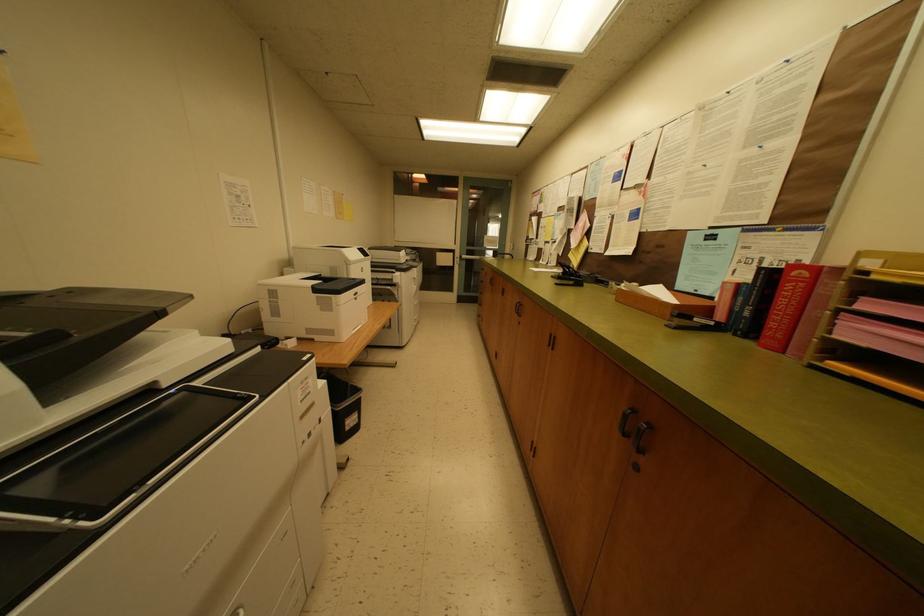
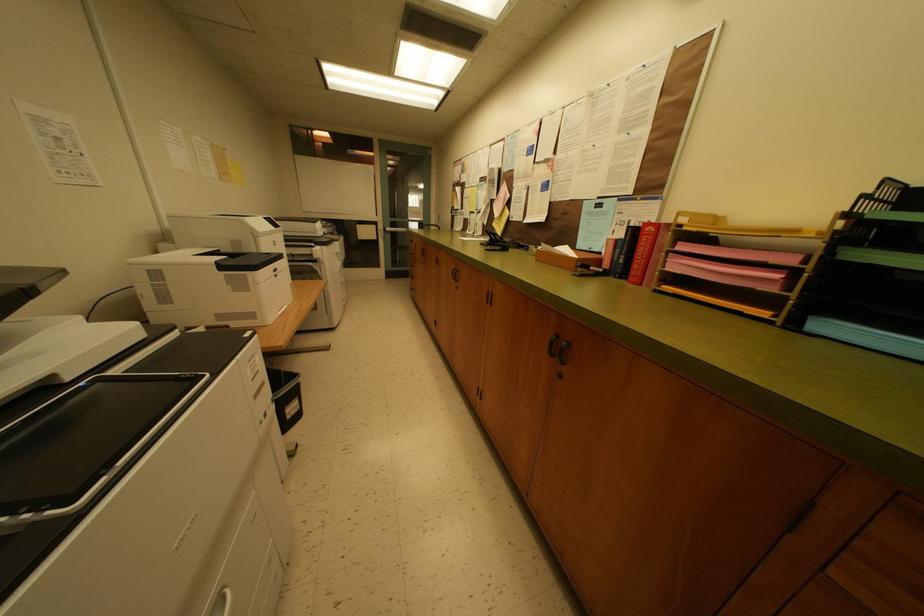
Question: Based on the continuous images, in which direction is the camera rotating? Reply with the corresponding letter.

Choices:
 (A) Left
 (B) Right
 (C) Up
 (D) Down

Answer: (B)